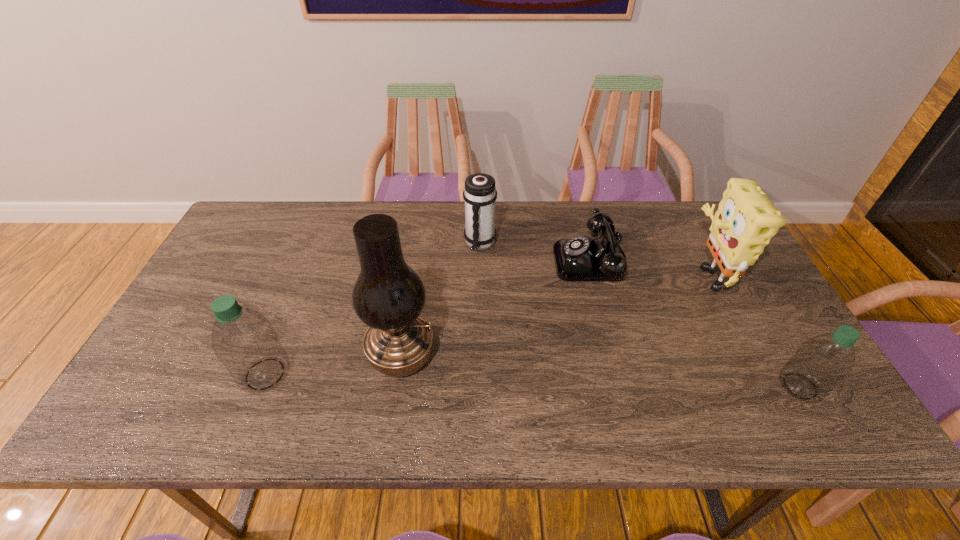
What are the coordinates of `thermos bottle that is at the far edge` in the screenshot? It's located at (479, 194).

Find the location of a particular element. The width and height of the screenshot is (960, 540). telephone located at the far edge is located at coordinates (580, 258).

You are a GUI agent. You are given a task and a screenshot of the screen. Output one action in this format:
    pyautogui.click(x=<x>, y=<y>)
    Task: Click on the oil lamp that is at the near edge
    This screenshot has height=540, width=960.
    Given the screenshot: What is the action you would take?
    pyautogui.click(x=388, y=296)

This screenshot has height=540, width=960. In order to click on water bottle that is at the right edge in this screenshot , I will do `click(822, 362)`.

Locate an element on the screen. This screenshot has width=960, height=540. sponge that is at the right edge is located at coordinates (746, 220).

Locate an element on the screen. Image resolution: width=960 pixels, height=540 pixels. object that is at the far right corner is located at coordinates (746, 220).

Locate an element on the screen. The height and width of the screenshot is (540, 960). object located at the near right corner is located at coordinates (822, 362).

The image size is (960, 540). Identify the location of vacant space at the far edge. (511, 244).

Locate an element on the screen. This screenshot has height=540, width=960. free space at the near edge of the desktop is located at coordinates (723, 369).

The width and height of the screenshot is (960, 540). In the image, there is a desktop. Identify the location of free space at the left edge. (257, 260).